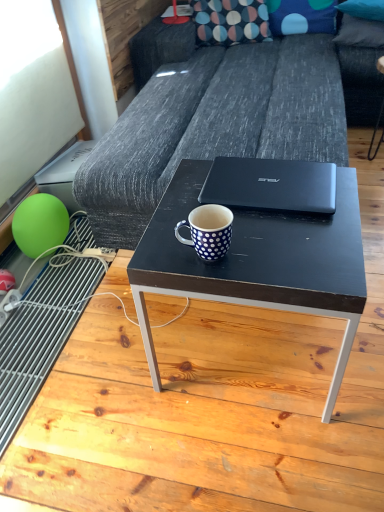
What is the approximate height of polka dot fabric pillow at upper center, the 3th pillow from the right?

polka dot fabric pillow at upper center, the 3th pillow from the right, is 26.18 centimeters in height.

This screenshot has width=384, height=512. I want to click on black matte laptop at center, so 271,185.

In the scene shown: What is the approximate width of black matte table at center?

The width of black matte table at center is 8.00 feet.

The width and height of the screenshot is (384, 512). What do you see at coordinates (208, 413) in the screenshot?
I see `black matte table at center` at bounding box center [208, 413].

Image resolution: width=384 pixels, height=512 pixels. What do you see at coordinates (301, 16) in the screenshot?
I see `blue dotted fabric pillow at upper center, the 2th pillow in the left-to-right sequence` at bounding box center [301, 16].

Locate an element on the screen. The height and width of the screenshot is (512, 384). blue dotted mug at center is located at coordinates (208, 231).

Relative to blue dotted fabric pillow at upper right, the third pillow positioned from the left, is black matte laptop at center in front or behind?

Visually, black matte laptop at center is located in front of blue dotted fabric pillow at upper right, the third pillow positioned from the left.

Can you confirm if black matte laptop at center is shorter than blue dotted fabric pillow at upper right, the 1th pillow in the right-to-left sequence?

Indeed, black matte laptop at center has a lesser height compared to blue dotted fabric pillow at upper right, the 1th pillow in the right-to-left sequence.

Is black matte laptop at center at the right side of blue dotted fabric pillow at upper right, the third pillow positioned from the left?

In fact, black matte laptop at center is to the left of blue dotted fabric pillow at upper right, the third pillow positioned from the left.

Considering the relative sizes of polka dot fabric pillow at upper center, positioned as the first pillow in left-to-right order, and green rubber balloon at lower left in the image provided, is polka dot fabric pillow at upper center, positioned as the first pillow in left-to-right order, wider than green rubber balloon at lower left?

Yes.

Is polka dot fabric pillow at upper center, positioned as the first pillow in left-to-right order, facing towards green rubber balloon at lower left?

Yes, polka dot fabric pillow at upper center, positioned as the first pillow in left-to-right order, is facing green rubber balloon at lower left.

Would you say polka dot fabric pillow at upper center, positioned as the first pillow in left-to-right order, contains green rubber balloon at lower left?

Definitely not — green rubber balloon at lower left is not inside polka dot fabric pillow at upper center, positioned as the first pillow in left-to-right order.

Which object is closer to the camera taking this photo, polka dot fabric pillow at upper center, the 3th pillow from the right, or green rubber balloon at lower left?

green rubber balloon at lower left is in front.

From a real-world perspective, is matte black coffee table at center on blue dotted fabric pillow at upper right, the 1th pillow in the right-to-left sequence?

Incorrect, from a real-world perspective, matte black coffee table at center is lower than blue dotted fabric pillow at upper right, the 1th pillow in the right-to-left sequence.

Between matte black coffee table at center and blue dotted fabric pillow at upper right, the 1th pillow in the right-to-left sequence, which one is positioned in front?

matte black coffee table at center is closer to the camera.

Considering the relative sizes of matte black coffee table at center and blue dotted fabric pillow at upper right, the 1th pillow in the right-to-left sequence, in the image provided, is matte black coffee table at center wider than blue dotted fabric pillow at upper right, the 1th pillow in the right-to-left sequence,?

Yes, matte black coffee table at center is wider than blue dotted fabric pillow at upper right, the 1th pillow in the right-to-left sequence.

Does matte black coffee table at center have a smaller size compared to blue dotted fabric pillow at upper right, the third pillow positioned from the left?

No.

Is matte black coffee table at center facing away from polka dot fabric pillow at upper center, the 3th pillow from the right?

No.

Is matte black coffee table at center located outside polka dot fabric pillow at upper center, positioned as the first pillow in left-to-right order?

Yes, matte black coffee table at center is outside of polka dot fabric pillow at upper center, positioned as the first pillow in left-to-right order.

Which object is further away from the camera taking this photo, matte black coffee table at center or polka dot fabric pillow at upper center, the 3th pillow from the right?

polka dot fabric pillow at upper center, the 3th pillow from the right, is behind.

Looking at their sizes, would you say matte black coffee table at center is wider or thinner than polka dot fabric pillow at upper center, positioned as the first pillow in left-to-right order?

Clearly, matte black coffee table at center has more width compared to polka dot fabric pillow at upper center, positioned as the first pillow in left-to-right order.

Is black matte table at center oriented away from blue dotted mug at center?

No.

What's the angular difference between black matte table at center and blue dotted mug at center's facing directions?

black matte table at center and blue dotted mug at center are facing 98.5 degrees away from each other.

From the image's perspective, is black matte table at center under blue dotted mug at center?

No, from the image's perspective, black matte table at center is not below blue dotted mug at center.

Does black matte table at center have a greater width compared to blue dotted mug at center?

Yes.

Can you confirm if black matte laptop at center is thinner than blue dotted mug at center?

In fact, black matte laptop at center might be wider than blue dotted mug at center.

From the image's perspective, is black matte laptop at center positioned above or below blue dotted mug at center?

black matte laptop at center is above blue dotted mug at center.

Measure the distance from black matte laptop at center to blue dotted mug at center.

They are 8.67 inches apart.

Does black matte laptop at center have a smaller size compared to blue dotted mug at center?

No, black matte laptop at center is not smaller than blue dotted mug at center.

In the scene shown: Considering the relative positions of dark gray fabric couch at center and blue dotted mug at center in the image provided, is dark gray fabric couch at center to the left or to the right of blue dotted mug at center?

dark gray fabric couch at center is to the right of blue dotted mug at center.

Consider the image. Is dark gray fabric couch at center in front of or behind blue dotted mug at center in the image?

dark gray fabric couch at center is positioned farther from the viewer than blue dotted mug at center.

How different are the orientations of dark gray fabric couch at center and blue dotted mug at center in degrees?

99.6 degrees separate the facing orientations of dark gray fabric couch at center and blue dotted mug at center.

Do you think dark gray fabric couch at center is within blue dotted mug at center, or outside of it?

The correct answer is: outside.

Locate an element on the screen. laptop above the blue dotted fabric pillow at upper right, the 1th pillow in the right-to-left sequence (from a real-world perspective) is located at coordinates [x=271, y=185].

You are a GUI agent. You are given a task and a screenshot of the screen. Output one action in this format:
    pyautogui.click(x=<x>, y=<y>)
    Task: Click on the balloon located below the polka dot fabric pillow at upper center, the 3th pillow from the right (from the image's perspective)
    
    Given the screenshot: What is the action you would take?
    pyautogui.click(x=40, y=224)

When comparing their distances from black matte laptop at center, does green rubber balloon at lower left or black matte table at center seem closer?

black matte table at center.

Which object lies nearer to the anchor point green rubber balloon at lower left, black matte laptop at center or polka dot fabric pillow at upper center, positioned as the first pillow in left-to-right order?

black matte laptop at center is positioned closer to the anchor green rubber balloon at lower left.

Based on their spatial positions, is polka dot fabric pillow at upper center, positioned as the first pillow in left-to-right order, or matte black coffee table at center further from black matte laptop at center?

The object further to black matte laptop at center is polka dot fabric pillow at upper center, positioned as the first pillow in left-to-right order.

When comparing their distances from matte black coffee table at center, does green rubber balloon at lower left or dark gray fabric couch at center seem further?

green rubber balloon at lower left.

Looking at the image, which one is located closer to green rubber balloon at lower left, blue dotted fabric pillow at upper right, the 1th pillow in the right-to-left sequence, or black matte table at center?

black matte table at center is closer to green rubber balloon at lower left.

Considering their positions, is black matte laptop at center positioned closer to polka dot fabric pillow at upper center, the 3th pillow from the right, than matte black coffee table at center?

Based on the image, black matte laptop at center appears to be nearer to polka dot fabric pillow at upper center, the 3th pillow from the right.

In the scene shown: Considering their positions, is black matte table at center positioned closer to dark gray fabric couch at center than blue dotted mug at center?

black matte table at center is positioned closer to the anchor dark gray fabric couch at center.

Based on their spatial positions, is green rubber balloon at lower left or blue dotted mug at center closer to black matte table at center?

blue dotted mug at center is closer to black matte table at center.

Where is `laptop positioned between blue dotted mug at center and blue dotted fabric pillow at upper center, the 2th pillow in the left-to-right sequence, from near to far`? laptop positioned between blue dotted mug at center and blue dotted fabric pillow at upper center, the 2th pillow in the left-to-right sequence, from near to far is located at coordinates (271, 185).

Find the location of `coffee table between green rubber balloon at lower left and black matte laptop at center in the horizontal direction`. coffee table between green rubber balloon at lower left and black matte laptop at center in the horizontal direction is located at coordinates (258, 262).

Find the location of `studio couch between blue dotted mug at center and polka dot fabric pillow at upper center, the 3th pillow from the right, along the z-axis`. studio couch between blue dotted mug at center and polka dot fabric pillow at upper center, the 3th pillow from the right, along the z-axis is located at coordinates (222, 117).

Where is `studio couch positioned between black matte table at center and polka dot fabric pillow at upper center, the 3th pillow from the right, from near to far`? The image size is (384, 512). studio couch positioned between black matte table at center and polka dot fabric pillow at upper center, the 3th pillow from the right, from near to far is located at coordinates (222, 117).